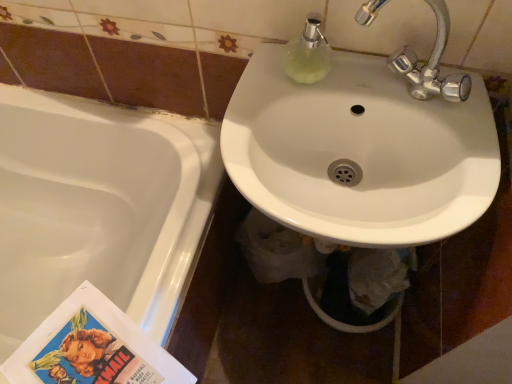
Question: Considering the relative positions of white glossy sink at center and white glossy bathtub at lower left in the image provided, is white glossy sink at center to the right of white glossy bathtub at lower left from the viewer's perspective?

Choices:
 (A) yes
 (B) no

Answer: (A)

Question: Is white glossy bathtub at lower left at the back of white glossy sink at center?

Choices:
 (A) yes
 (B) no

Answer: (B)

Question: From the image's perspective, would you say white glossy sink at center is shown under white glossy bathtub at lower left?

Choices:
 (A) no
 (B) yes

Answer: (A)

Question: Is white glossy sink at center positioned behind white glossy bathtub at lower left?

Choices:
 (A) no
 (B) yes

Answer: (A)

Question: Does white glossy sink at center have a smaller size compared to white glossy bathtub at lower left?

Choices:
 (A) yes
 (B) no

Answer: (A)

Question: Would you say white glossy bathtub at lower left is to the left or to the right of white glossy sink at center in the picture?

Choices:
 (A) right
 (B) left

Answer: (B)

Question: Would you say white glossy bathtub at lower left is inside or outside white glossy sink at center?

Choices:
 (A) inside
 (B) outside

Answer: (B)

Question: Is point (145, 172) positioned closer to the camera than point (342, 145)?

Choices:
 (A) farther
 (B) closer

Answer: (A)

Question: From their relative heights in the image, would you say white glossy bathtub at lower left is taller or shorter than white glossy sink at center?

Choices:
 (A) tall
 (B) short

Answer: (A)

Question: Choose the correct answer: Is white glossy bathtub at lower left inside translucent glass soap dispenser at upper center or outside it?

Choices:
 (A) inside
 (B) outside

Answer: (B)

Question: Considering their positions, is white glossy bathtub at lower left located in front of or behind translucent glass soap dispenser at upper center?

Choices:
 (A) behind
 (B) front

Answer: (A)

Question: Considering the positions of point (22, 279) and point (311, 21), is point (22, 279) closer or farther from the camera than point (311, 21)?

Choices:
 (A) farther
 (B) closer

Answer: (A)

Question: Based on their sizes in the image, would you say white glossy bathtub at lower left is bigger or smaller than translucent glass soap dispenser at upper center?

Choices:
 (A) small
 (B) big

Answer: (B)

Question: From a real-world perspective, is translucent glass soap dispenser at upper center physically located above or below white glossy bathtub at lower left?

Choices:
 (A) below
 (B) above

Answer: (B)

Question: Is translucent glass soap dispenser at upper center situated inside white glossy bathtub at lower left or outside?

Choices:
 (A) outside
 (B) inside

Answer: (A)